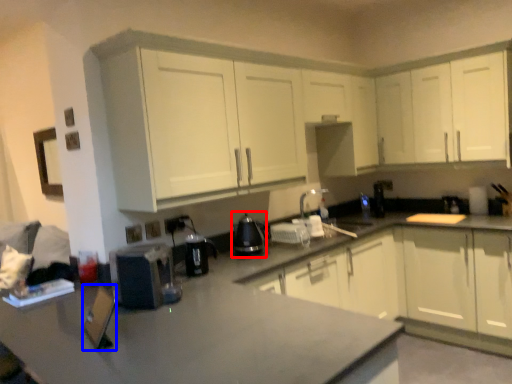
Question: Which point is further to the camera, appliance (highlighted by a red box) or appliance (highlighted by a blue box)?

Choices:
 (A) appliance
 (B) appliance

Answer: (A)